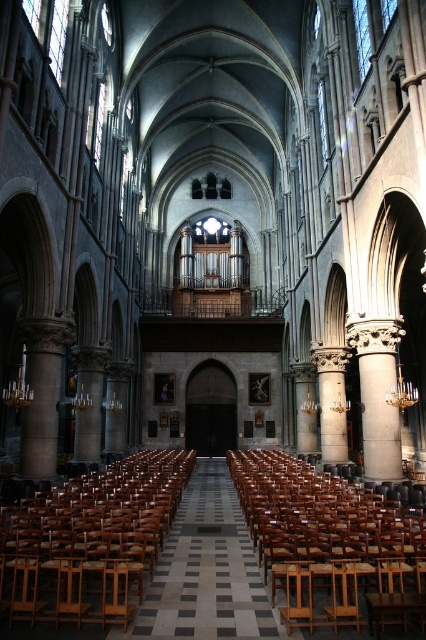
You are standing in the grand cathedral and want to sit down. There is a wooden polished chair at center. Is the point at coordinate (328, 541) located on this chair?

Yes, the point at coordinate (328, 541) is on the wooden polished chair at center, so it is located on the chair.

You are standing in the grand cathedral and want to find a place to sit. The wooden chair at center is located at point (91,540). Can you estimate where this chair is positioned in the cathedral?

The wooden chair at center is located at point (91,540), which is at the center of the cathedral.